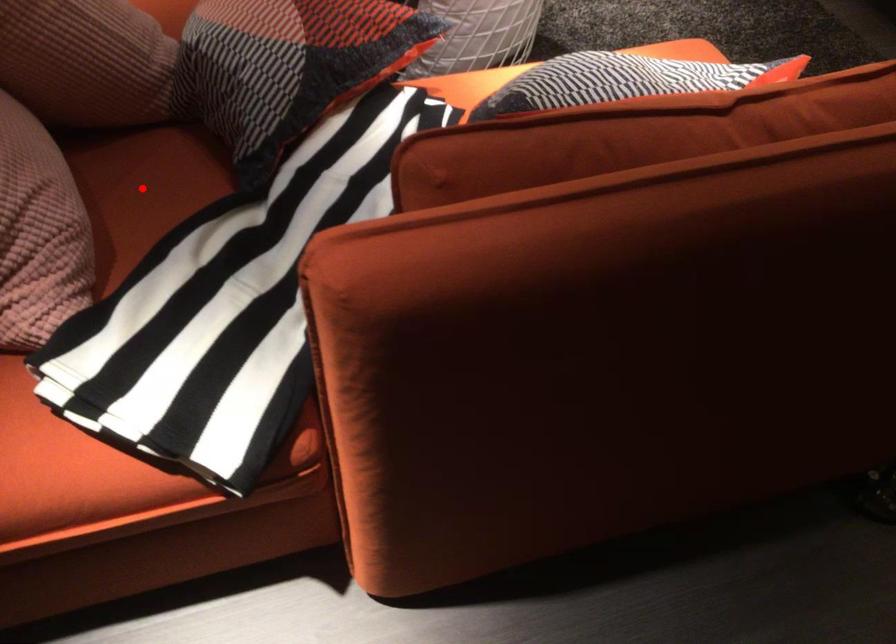
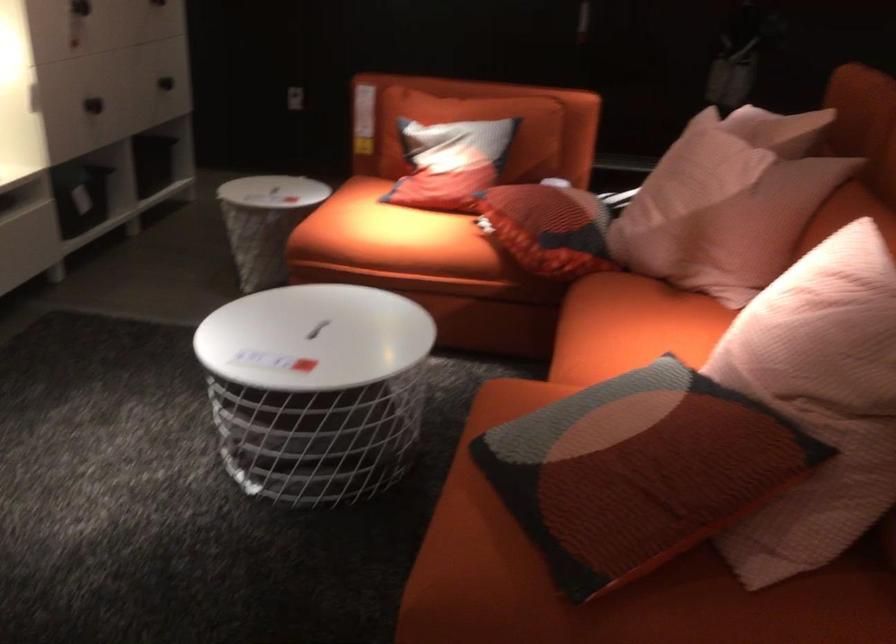
Question: I am providing you with two images of the same scene from different viewpoints. A red point is marked on the first image. Is the red point's position out of view in image 2?

Choices:
 (A) Yes
 (B) No

Answer: (A)